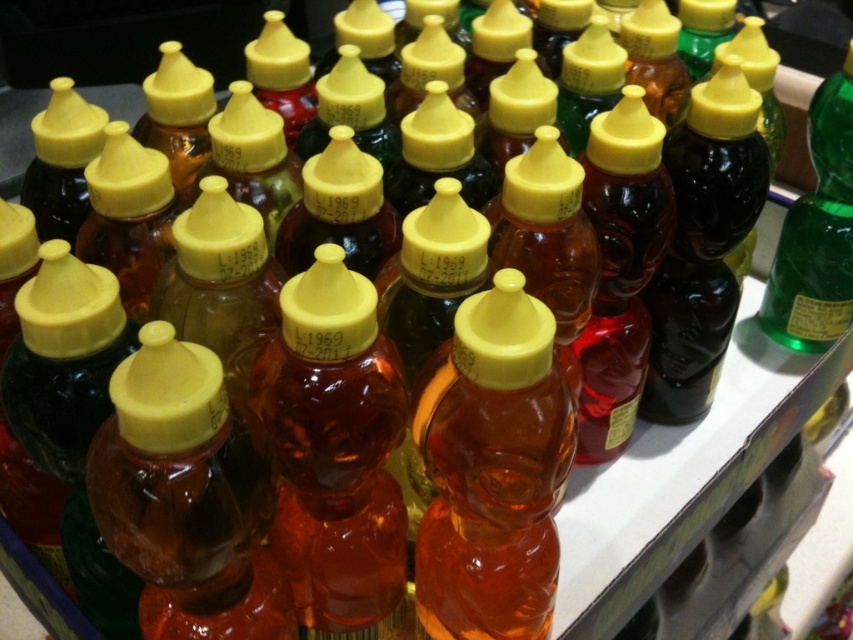
Question: Can you confirm if translucent amber liquid at center is thinner than green glass bottle at right?

Choices:
 (A) no
 (B) yes

Answer: (A)

Question: Which object is farther from the camera taking this photo?

Choices:
 (A) green glass bottle at right
 (B) translucent amber liquid at center

Answer: (A)

Question: Is translucent amber liquid at center smaller than green glass bottle at right?

Choices:
 (A) no
 (B) yes

Answer: (A)

Question: Which object is closer to the camera taking this photo?

Choices:
 (A) green glass bottle at right
 (B) translucent amber liquid at center

Answer: (B)

Question: Is translucent amber liquid at center positioned in front of green glass bottle at right?

Choices:
 (A) yes
 (B) no

Answer: (A)